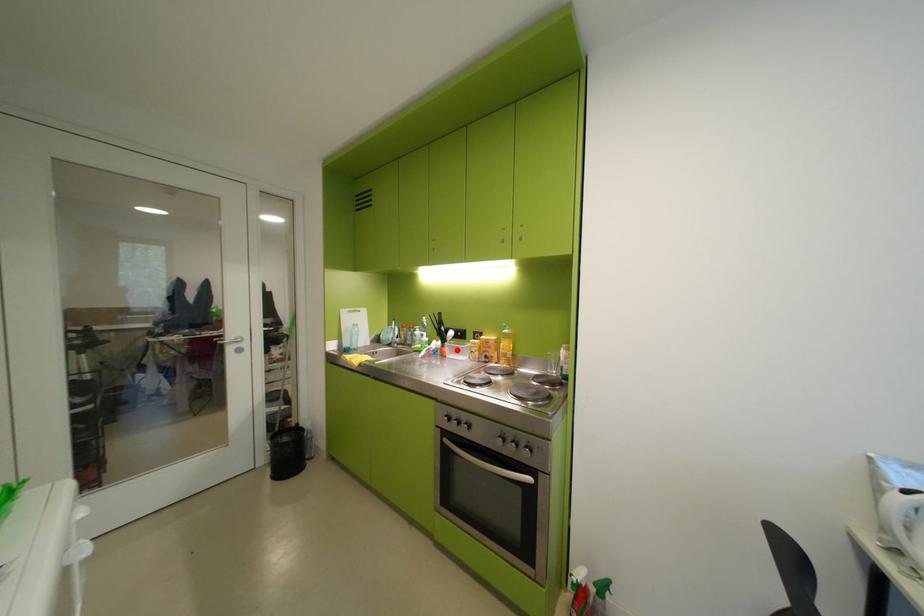
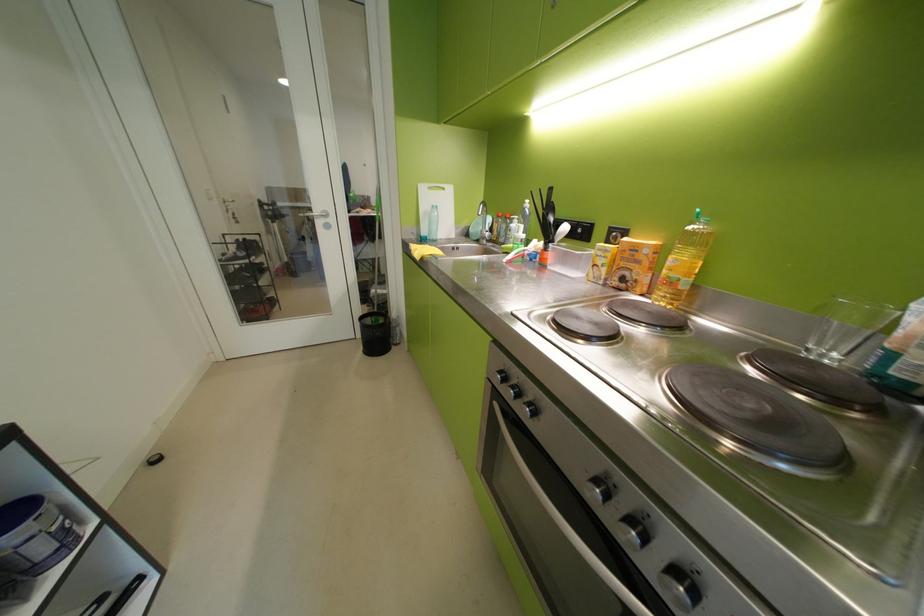
Question: I am providing you with two images of the same scene from different viewpoints. In image1, a red point is highlighted. Considering the same 3D point in image2, which of the following is correct?

Choices:
 (A) It is closer
 (B) It is farther

Answer: (A)